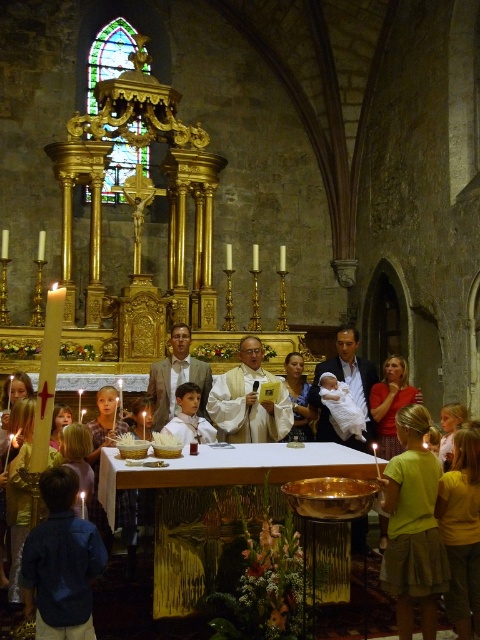
Question: Which object is positioned closest to the white satin robe at center?

Choices:
 (A) gold polished table at center
 (B) blue denim shirt at lower left

Answer: (A)

Question: Which object is positioned farthest from the gold polished table at center?

Choices:
 (A) white satin robe at center
 (B) blue denim shirt at lower left

Answer: (A)

Question: Is gold polished table at center to the left of blue denim shirt at lower left from the viewer's perspective?

Choices:
 (A) yes
 (B) no

Answer: (B)

Question: Which point is closer to the camera?

Choices:
 (A) (274, 458)
 (B) (194, 403)

Answer: (A)

Question: Can you confirm if gold polished table at center is positioned to the right of white satin robe at center?

Choices:
 (A) yes
 (B) no

Answer: (A)

Question: Is blue denim shirt at lower left below white satin robe at center?

Choices:
 (A) no
 (B) yes

Answer: (B)